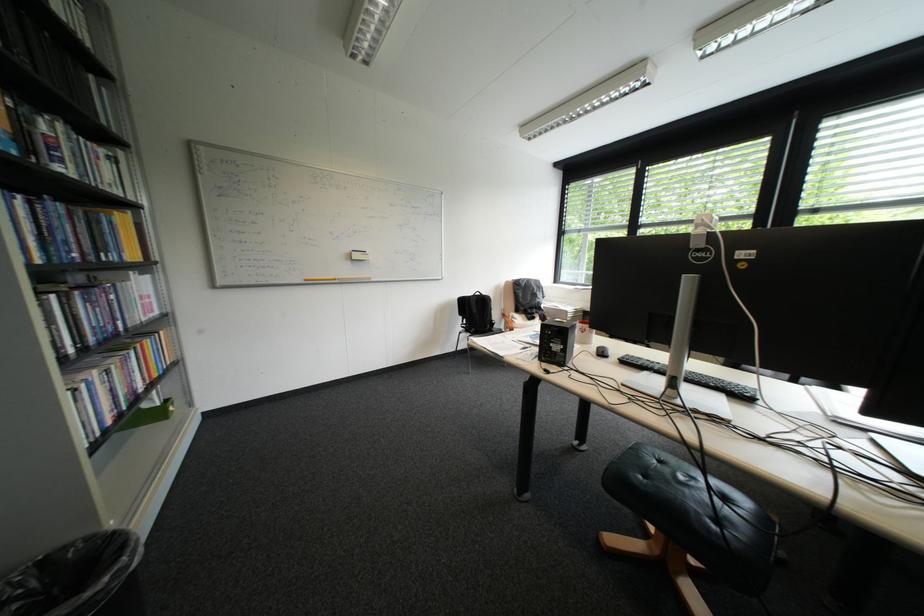
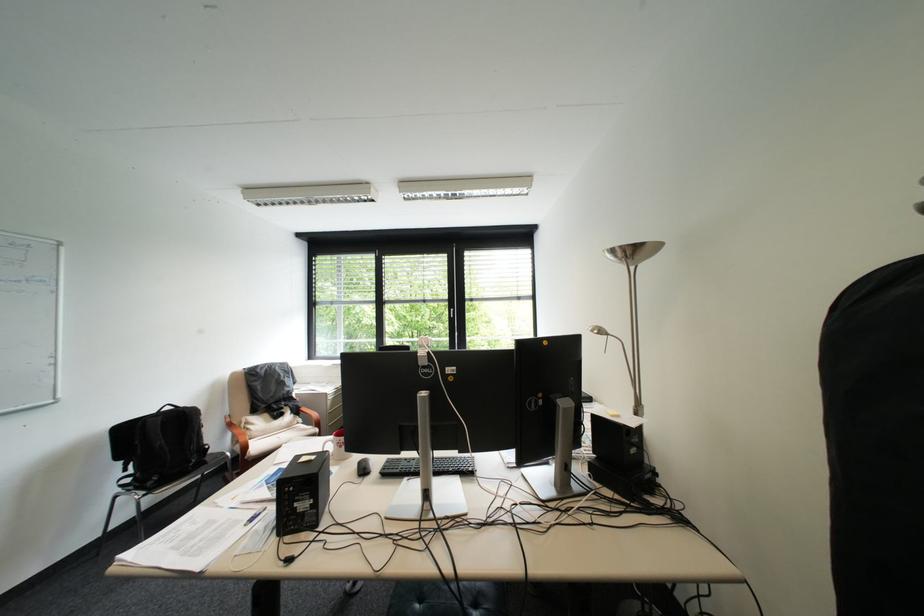
Where in the second image is the point corresponding to the point at 496,297 from the first image?

(198, 411)